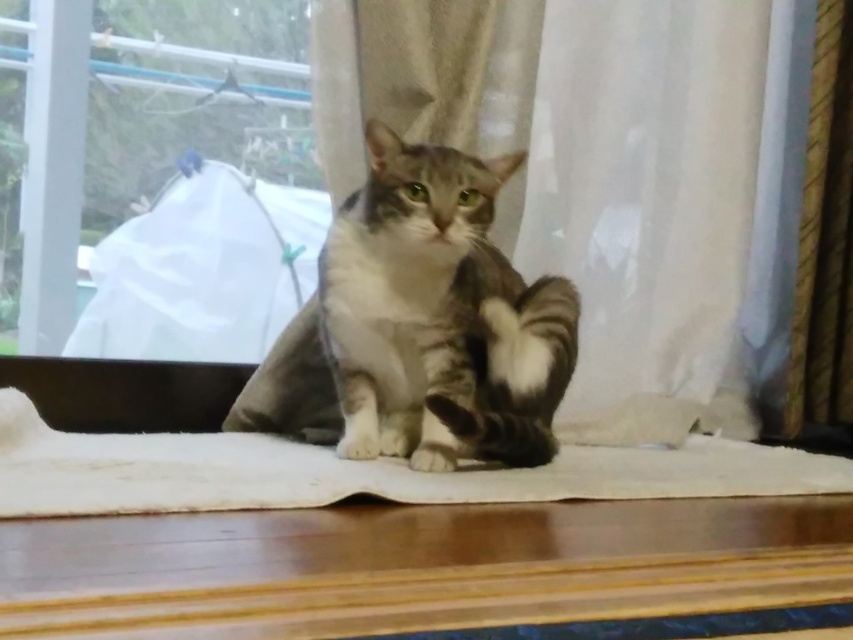
Is point (190, 48) positioned before point (102, 440)?

That is False.

Is transparent plastic bag at left above white fabric mat at center?

Correct, transparent plastic bag at left is located above white fabric mat at center.

Is point (126, 90) farther from camera compared to point (666, 492)?

Yes, it is.

You are a GUI agent. You are given a task and a screenshot of the screen. Output one action in this format:
    pyautogui.click(x=<x>, y=<y>)
    Task: Click on the transparent plastic bag at left
    The width and height of the screenshot is (853, 640).
    Given the screenshot: What is the action you would take?
    pyautogui.click(x=165, y=202)

Is point (724, 333) closer to camera compared to point (445, 490)?

That is False.

From the picture: Can you confirm if silky white curtain at center is bigger than white fabric mat at center?

Yes.

In order to click on silky white curtain at center in this screenshot , I will do `click(651, 193)`.

Is point (606, 387) in front of point (461, 349)?

No, it is not.

Locate an element on the screen. The width and height of the screenshot is (853, 640). silky white curtain at center is located at coordinates (651, 193).